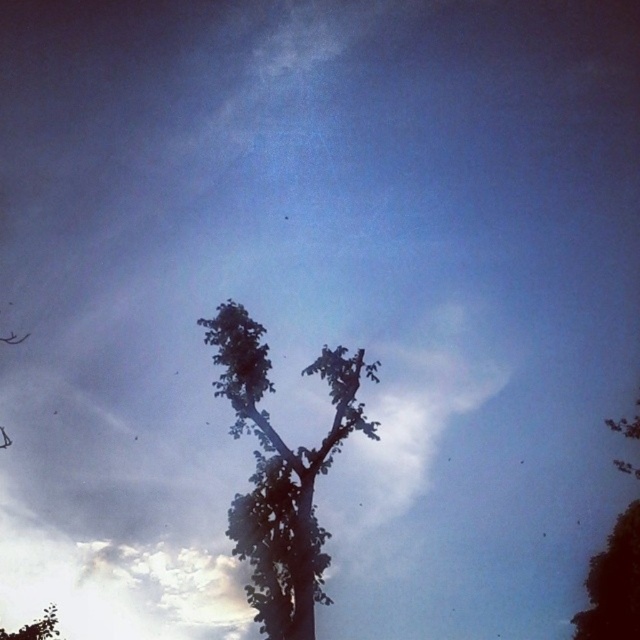
You are a bird looking for a place to perch. You see the silhouette leafy tree at upper right and the green leafy tree at lower left. Which tree is located above the other?

The silhouette leafy tree at upper right is positioned over the green leafy tree at lower left.

You are standing in front of the tree and see two points in the image. The first point is at coordinate point (225, 369) and the second is at point (618, 628). Which point is closer to you?

Point (225, 369) is in front of point 0.986, 0.966, so the first point is closer to you.